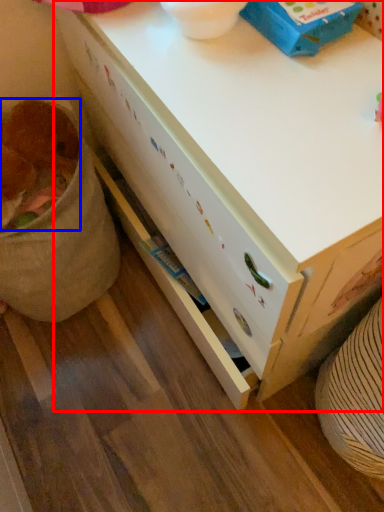
Question: Which object is closer to the camera taking this photo, desk (highlighted by a red box) or animal (highlighted by a blue box)?

Choices:
 (A) desk
 (B) animal

Answer: (A)